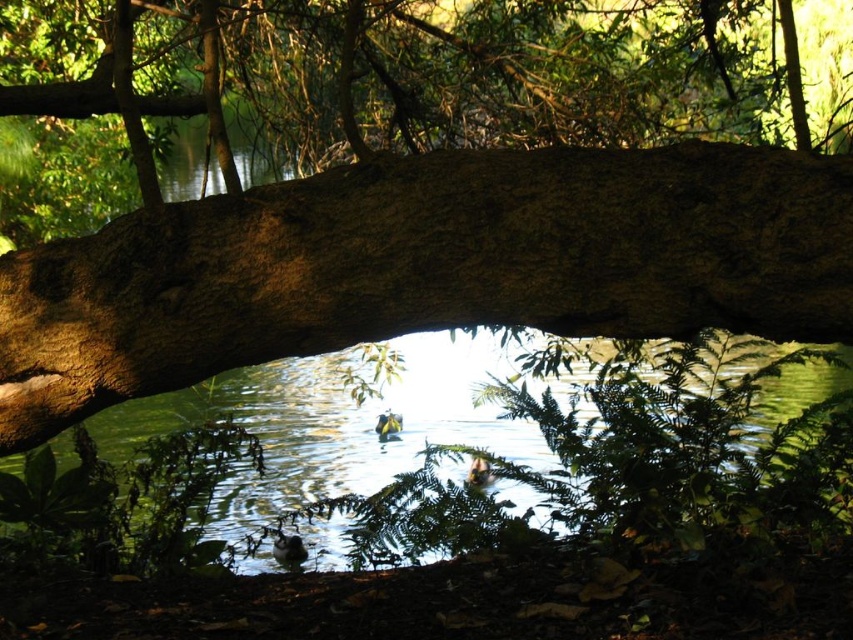
Question: Which point is closer to the camera taking this photo?

Choices:
 (A) (485, 428)
 (B) (799, 333)

Answer: (B)

Question: From the image, what is the correct spatial relationship of brown rough tree trunk at center in relation to green liquid water at center?

Choices:
 (A) above
 (B) below

Answer: (A)

Question: Is brown rough tree trunk at center wider than green liquid water at center?

Choices:
 (A) yes
 (B) no

Answer: (B)

Question: Where is brown rough tree trunk at center located in relation to green liquid water at center in the image?

Choices:
 (A) below
 (B) above

Answer: (B)